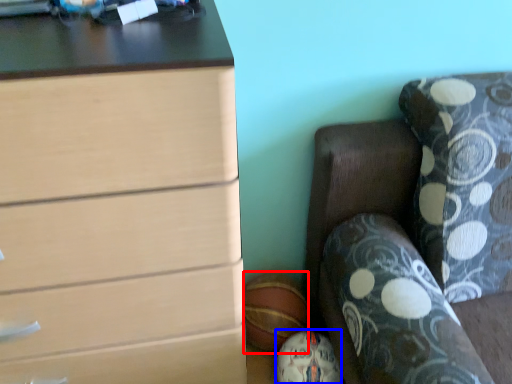
Question: Which object appears closest to the camera in this image, sports equipment (highlighted by a red box) or sports equipment (highlighted by a blue box)?

Choices:
 (A) sports equipment
 (B) sports equipment

Answer: (B)